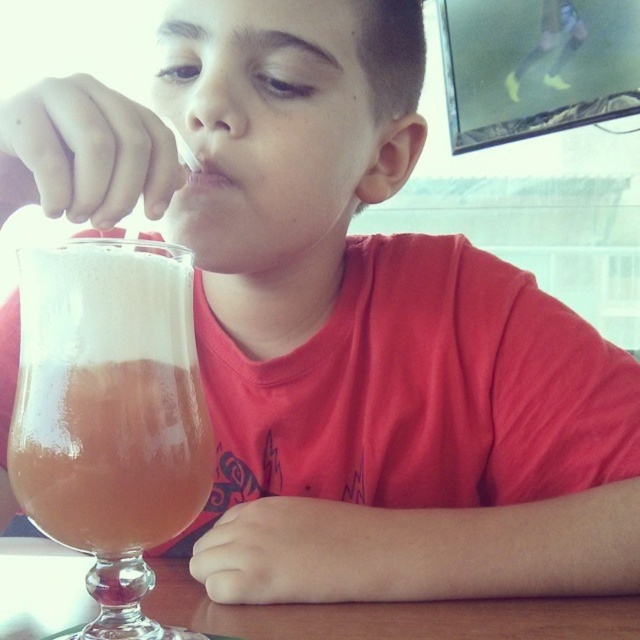
Question: Which of the following is the closest to the observer?

Choices:
 (A) (563, 627)
 (B) (148, 346)

Answer: (B)

Question: Is translucent glass beverage at lower left behind wooden table at lower center?

Choices:
 (A) no
 (B) yes

Answer: (A)

Question: Among these objects, which one is nearest to the camera?

Choices:
 (A) translucent glass beverage at lower left
 (B) wooden table at lower center

Answer: (A)

Question: Is translucent glass beverage at lower left positioned before wooden table at lower center?

Choices:
 (A) yes
 (B) no

Answer: (A)

Question: Which of the following is the closest to the observer?

Choices:
 (A) translucent glass beverage at lower left
 (B) wooden table at lower center

Answer: (A)

Question: Can you confirm if translucent glass beverage at lower left is positioned to the right of wooden table at lower center?

Choices:
 (A) no
 (B) yes

Answer: (B)